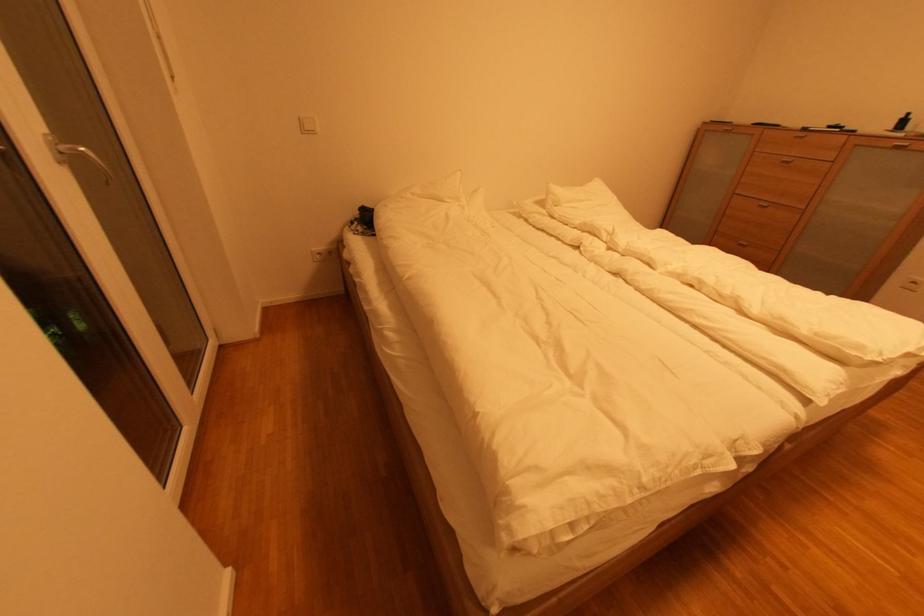
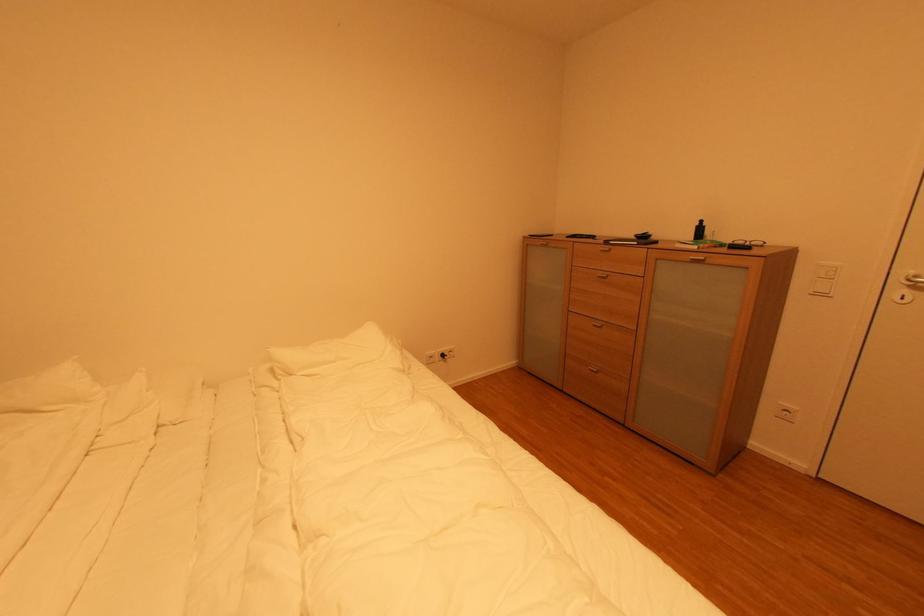
The images are taken continuously from a first-person perspective. In which direction are you moving?

The cameraman moved toward right, forward.